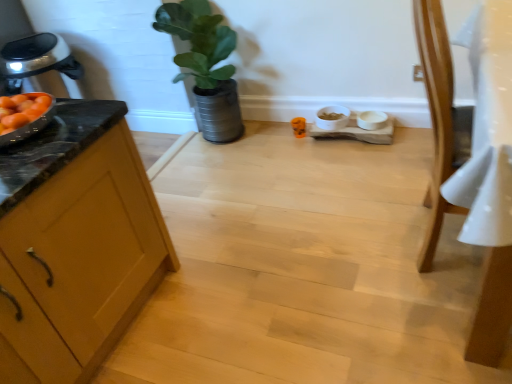
Where is `vacant region to the right of wooden cabinet at left`? vacant region to the right of wooden cabinet at left is located at coordinates (240, 268).